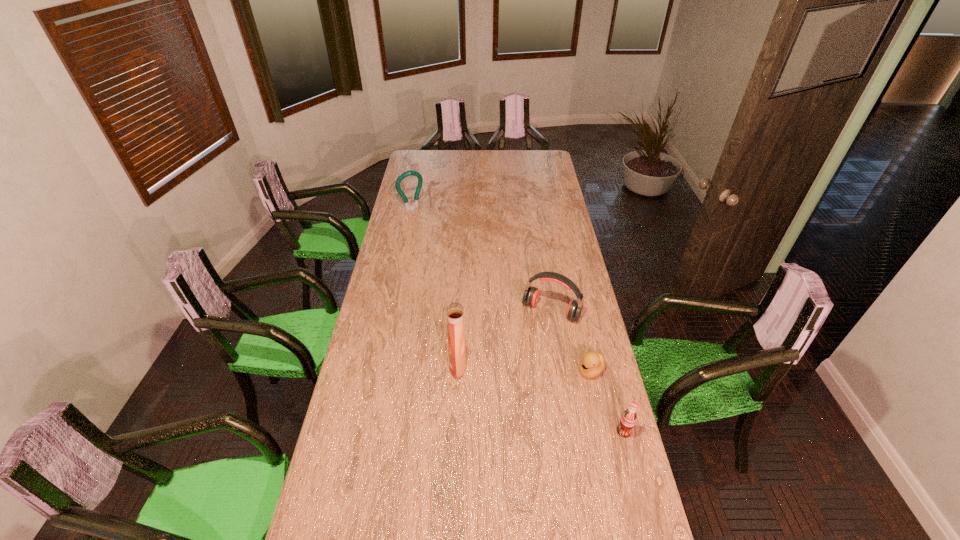
Find the location of a particular element. The height and width of the screenshot is (540, 960). vacant point located at the jaws of the leftmost object is located at coordinates (445, 251).

The width and height of the screenshot is (960, 540). I want to click on vacant area situated at the jaws of the leftmost object, so click(435, 237).

Identify the location of object located at the left edge. (420, 180).

This screenshot has height=540, width=960. I want to click on soda located in the right edge section of the desktop, so click(x=628, y=419).

Identify the location of earphone situated at the right edge. This screenshot has width=960, height=540. (531, 295).

Find the location of a particular element. Image resolution: width=960 pixels, height=540 pixels. duckling present at the right edge is located at coordinates (x=593, y=363).

The image size is (960, 540). What are the coordinates of `vacant area at the near edge of the desktop` in the screenshot? It's located at (521, 497).

In the image, there is a desktop. Where is `free space at the left edge`? This screenshot has height=540, width=960. free space at the left edge is located at coordinates (365, 356).

In the image, there is a desktop. What are the coordinates of `free space at the right edge` in the screenshot? It's located at (579, 335).

Where is `unoccupied position between the second farthest object and the shortest object`? This screenshot has height=540, width=960. unoccupied position between the second farthest object and the shortest object is located at coordinates (571, 340).